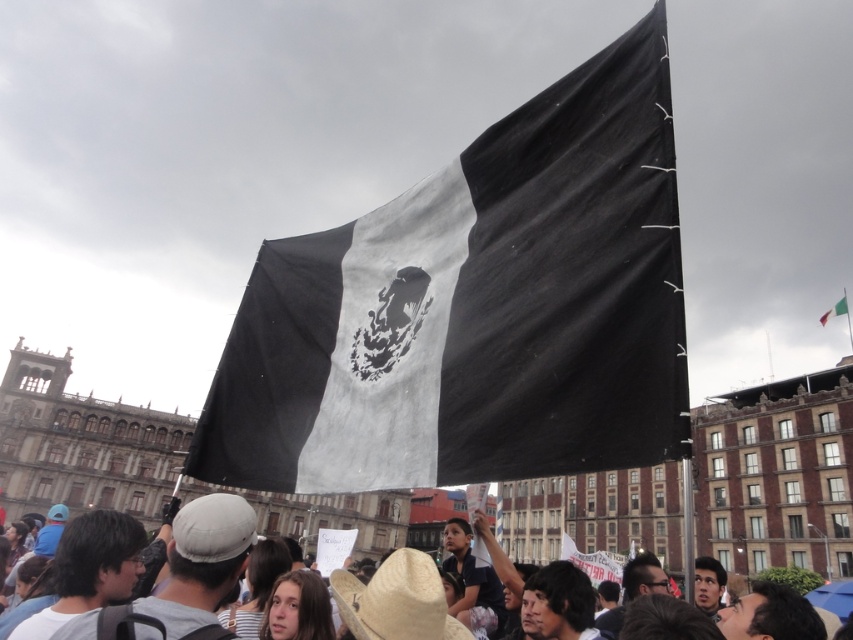
Does black fabric flag at center have a greater height compared to white fabric flag at upper center?

Yes, black fabric flag at center is taller than white fabric flag at upper center.

Is black fabric flag at center shorter than white fabric flag at upper center?

Incorrect, black fabric flag at center's height does not fall short of white fabric flag at upper center's.

Which is behind, point (322, 237) or point (843, 289)?

Point (843, 289)

This screenshot has width=853, height=640. What are the coordinates of `black fabric flag at center` in the screenshot? It's located at (476, 308).